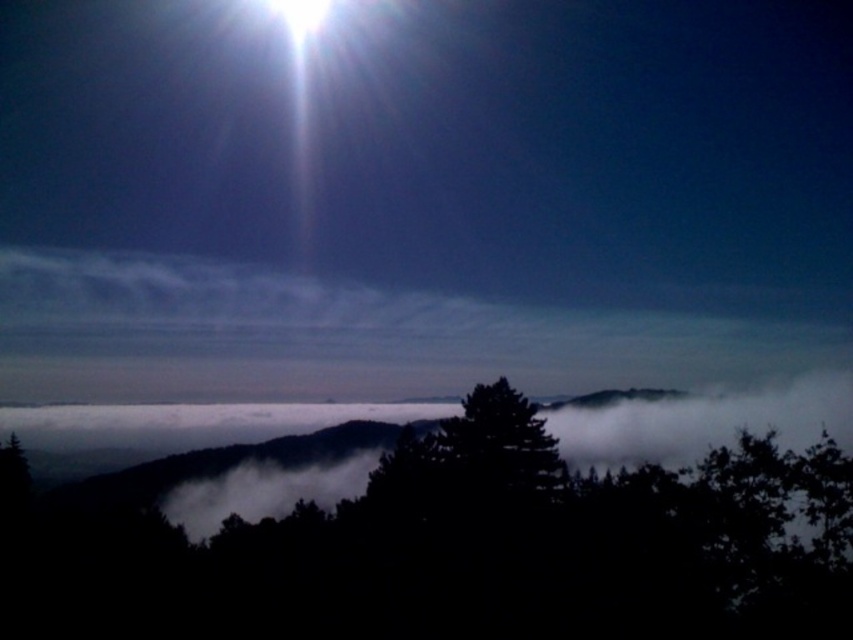
Based on the photo, you are an astronomer observing the sky and see the dark green leafy tree at center and the bright white light at upper center. Which object is closer to the right edge of the image?

The dark green leafy tree at center is closer to the right edge of the image because it is positioned on the right side of the bright white light at upper center.

You are an astronomer observing the sky. You notice the dark green leafy tree at center and the bright white light at upper center. Which object is closer to you?

The dark green leafy tree at center is closer to the viewer than the bright white light at upper center.